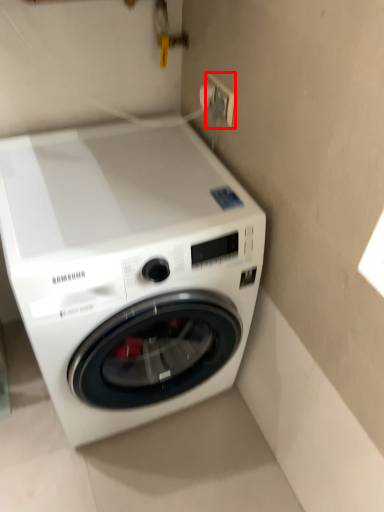
Question: From the image's perspective, what is the correct spatial relationship of electric outlet (annotated by the red box) in relation to washing machine?

Choices:
 (A) below
 (B) above

Answer: (B)